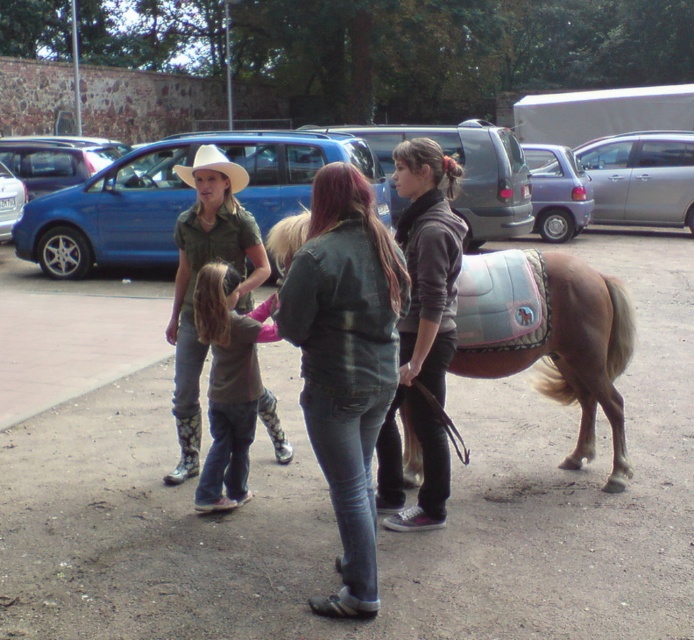
Find the location of a particular element. The image size is (694, 640). leather jacket at center is located at coordinates (346, 360).

Is leather jacket at center taller than dark gray fleece hoodie at center?

Incorrect, leather jacket at center's height is not larger of dark gray fleece hoodie at center's.

Who is more forward, [344,282] or [446,176]?

Point [344,282]

This screenshot has height=640, width=694. I want to click on leather jacket at center, so click(346, 360).

Is leather jacket at center bigger than light brown leather saddle at lower right?

Actually, leather jacket at center might be smaller than light brown leather saddle at lower right.

Does leather jacket at center appear over light brown leather saddle at lower right?

Yes, leather jacket at center is above light brown leather saddle at lower right.

Is point (391, 333) more distant than point (498, 330)?

No, (391, 333) is closer to viewer.

Find the location of a particular element. leather jacket at center is located at coordinates (346, 360).

Between dark gray fleece hoodie at center and brown denim pants at center, which one is positioned lower?

brown denim pants at center

Is point (405, 339) in front of point (214, 428)?

Yes, point (405, 339) is closer to viewer.

Where is `dark gray fleece hoodie at center`? This screenshot has width=694, height=640. dark gray fleece hoodie at center is located at coordinates (423, 330).